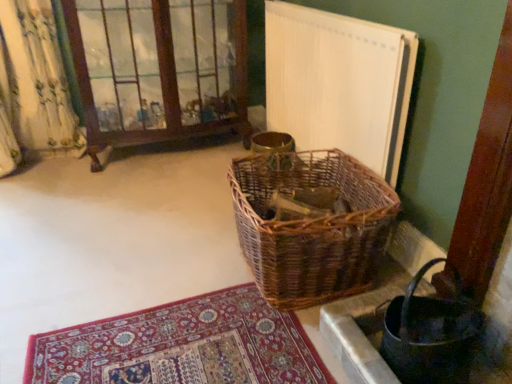
The height and width of the screenshot is (384, 512). In order to click on vacant space in brown wooden window frame at upper left (from a real-world perspective) in this screenshot , I will do `click(158, 154)`.